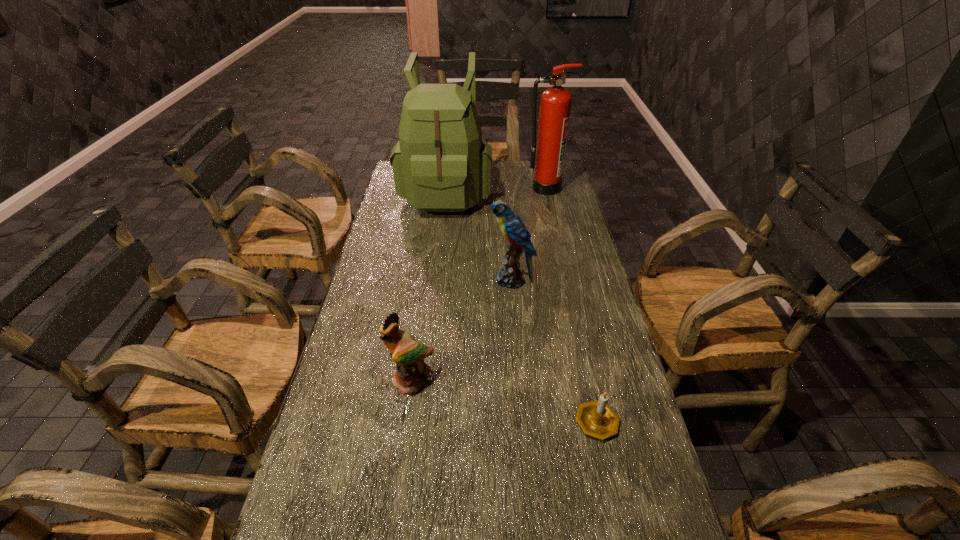
Locate an element on the screen. candle holder located at the right edge is located at coordinates (596, 418).

In order to click on object that is at the far left corner in this screenshot , I will do `click(440, 164)`.

You are a GUI agent. You are given a task and a screenshot of the screen. Output one action in this format:
    pyautogui.click(x=<x>, y=<y>)
    Task: Click on the object that is at the far right corner
    This screenshot has width=960, height=540.
    Given the screenshot: What is the action you would take?
    pyautogui.click(x=548, y=158)

Image resolution: width=960 pixels, height=540 pixels. I want to click on free location at the left edge of the desktop, so click(x=382, y=219).

Find the location of `vacant space at the right edge`. vacant space at the right edge is located at coordinates (562, 312).

Locate an element on the screen. Image resolution: width=960 pixels, height=540 pixels. vacant space in between the fire extinguisher and the candle holder is located at coordinates (571, 304).

I want to click on free space between the farther parrot and the shortest object, so click(554, 350).

Find the location of `free point between the right parrot and the shortest object`. free point between the right parrot and the shortest object is located at coordinates (554, 350).

Find the location of a particular element. vacant space that is in between the shortest object and the backpack is located at coordinates (521, 306).

Find the location of `free space between the left parrot and the fire extinguisher`. free space between the left parrot and the fire extinguisher is located at coordinates (478, 285).